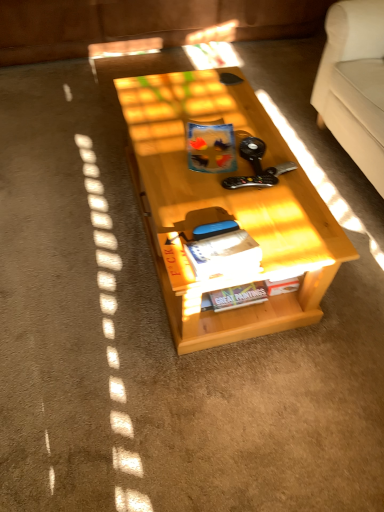
Find the location of a particular element. The image size is (384, 512). vacant area that lies to the right of matte paper magazine at center is located at coordinates (288, 243).